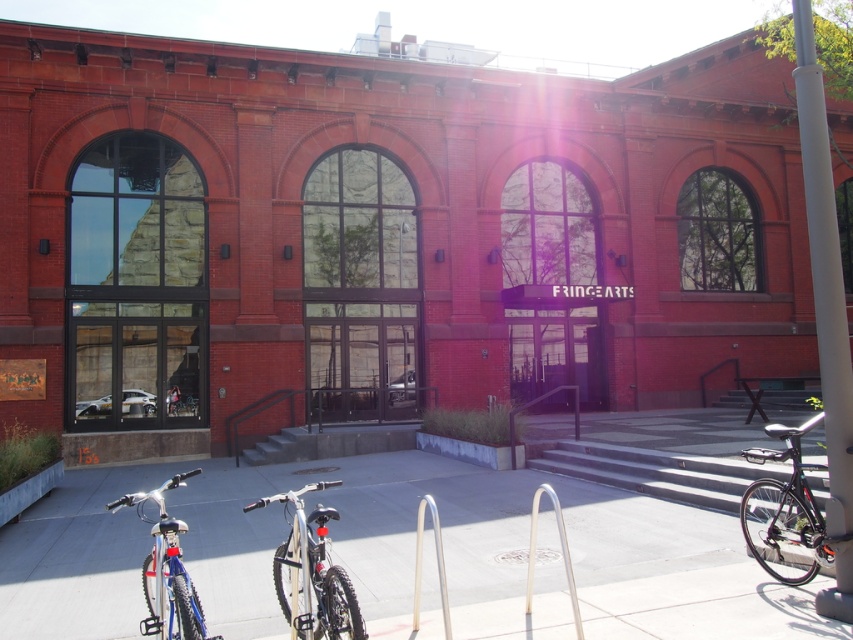
Question: Which object appears farthest from the camera in this image?

Choices:
 (A) white plastic pole at right
 (B) smooth concrete pavement at center
 (C) shiny silver bicycle at center

Answer: (A)

Question: Which object appears farthest from the camera in this image?

Choices:
 (A) white plastic pole at right
 (B) shiny silver bicycle at center
 (C) silver metallic bike rack at center
 (D) shiny blue bike at lower left

Answer: (C)

Question: Is shiny silver bicycle at center bigger than shiny blue bike at lower left?

Choices:
 (A) no
 (B) yes

Answer: (A)

Question: Which object is positioned closest to the silver metallic bike rack at center?

Choices:
 (A) matte black bicycle at lower left
 (B) smooth concrete pavement at center
 (C) shiny silver bicycle at center

Answer: (B)

Question: Is shiny black bike at right bigger than matte black bicycle at lower left?

Choices:
 (A) no
 (B) yes

Answer: (A)

Question: Is shiny black bike at right wider than shiny silver bicycle at center?

Choices:
 (A) yes
 (B) no

Answer: (B)